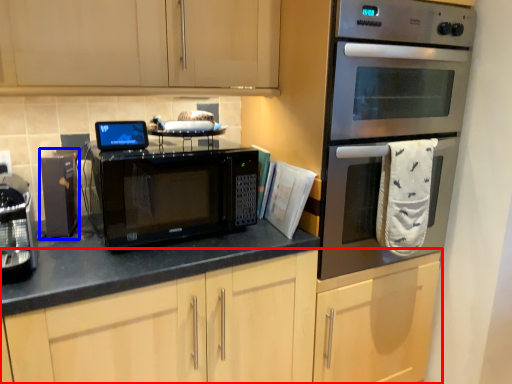
Question: Among these objects, which one is nearest to the camera, cabinetry (highlighted by a red box) or appliance (highlighted by a blue box)?

Choices:
 (A) cabinetry
 (B) appliance

Answer: (A)